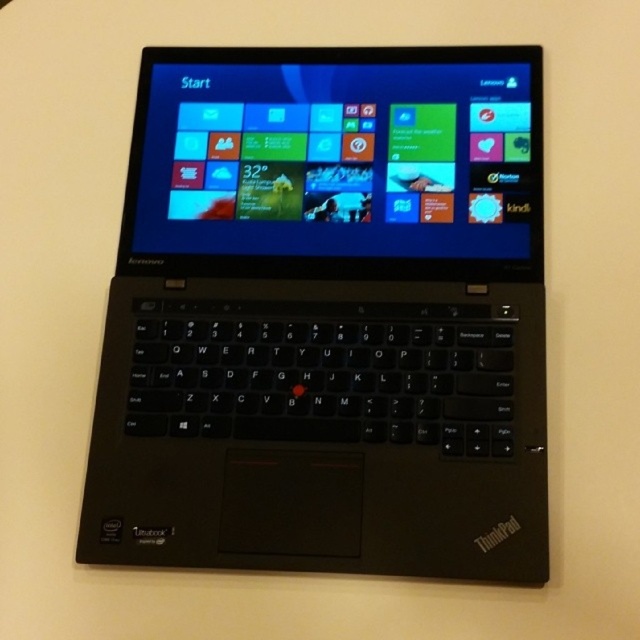
Question: Among these objects, which one is farthest from the camera?

Choices:
 (A) matte black screen at center
 (B) black matte thinkpad at center

Answer: (A)

Question: Is black matte thinkpad at center thinner than matte black screen at center?

Choices:
 (A) yes
 (B) no

Answer: (B)

Question: Which object appears farthest from the camera in this image?

Choices:
 (A) black matte thinkpad at center
 (B) matte black screen at center

Answer: (B)

Question: Is black matte thinkpad at center positioned in front of matte black screen at center?

Choices:
 (A) yes
 (B) no

Answer: (A)

Question: Is black matte thinkpad at center below matte black screen at center?

Choices:
 (A) yes
 (B) no

Answer: (A)